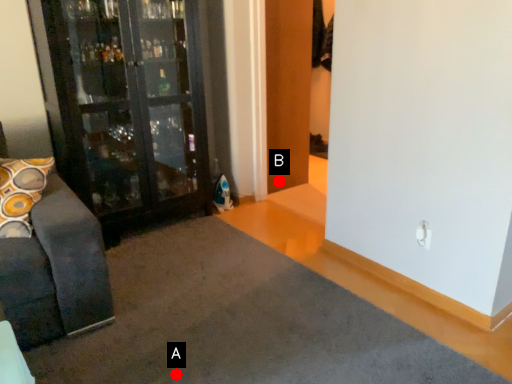
Question: Two points are circled on the image, labeled by A and B beside each circle. Which point is farther to the camera?

Choices:
 (A) A is further
 (B) B is further

Answer: (B)